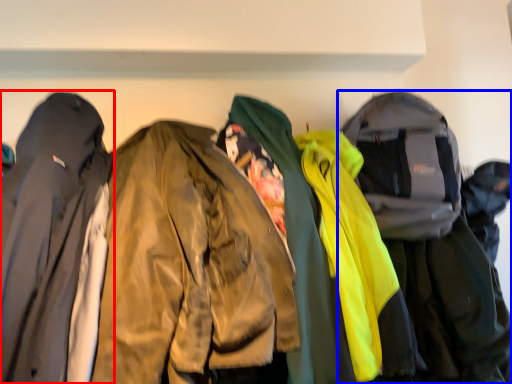
Question: Which object is further to the camera taking this photo, jacket (highlighted by a red box) or jacket (highlighted by a blue box)?

Choices:
 (A) jacket
 (B) jacket

Answer: (B)